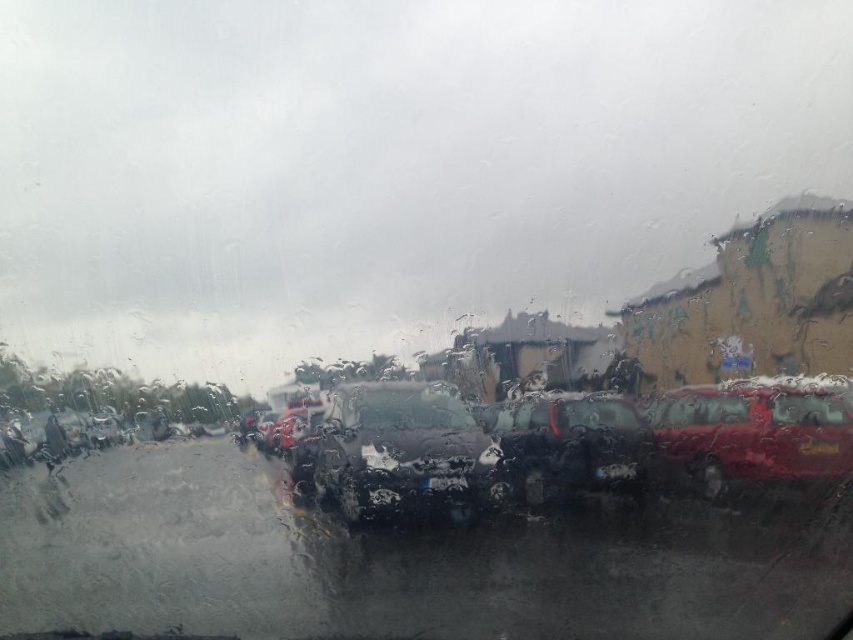
Question: Can you confirm if glossy metallic car at right is thinner than black plastic license plate at lower right?

Choices:
 (A) no
 (B) yes

Answer: (A)

Question: Can you confirm if glossy metallic car at right is wider than black plastic license plate at lower right?

Choices:
 (A) no
 (B) yes

Answer: (B)

Question: Which point is closer to the camera?

Choices:
 (A) (703, 467)
 (B) (830, 451)

Answer: (B)

Question: Is glossy metallic car at right behind black plastic license plate at lower right?

Choices:
 (A) yes
 (B) no

Answer: (B)